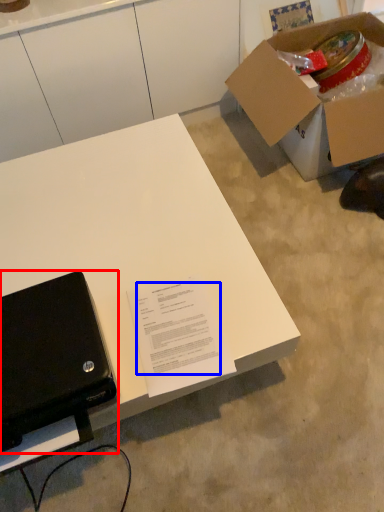
Question: Which of the following is the farthest to the observer, laptop (highlighted by a red box) or writing (highlighted by a blue box)?

Choices:
 (A) laptop
 (B) writing

Answer: (B)